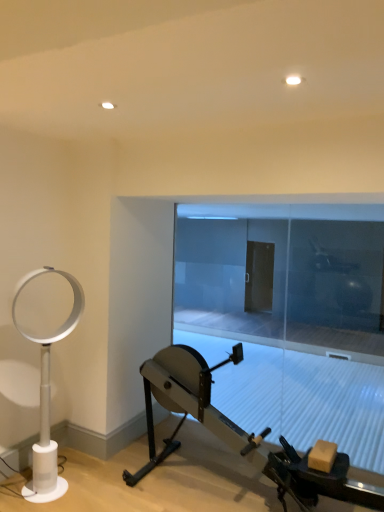
Locate an element on the screen. The width and height of the screenshot is (384, 512). metallic silver stationary bicycle at center is located at coordinates (239, 432).

What is the approximate height of white plastic fan at left?

The height of white plastic fan at left is 1.42 meters.

In order to face transparent glass door at center, should I rotate leftwards or rightwards?

Turn right approximately 10.492 degrees to face it.

This screenshot has height=512, width=384. What are the coordinates of `metallic silver stationary bicycle at center` in the screenshot? It's located at (239, 432).

Looking at the image, does metallic silver stationary bicycle at center seem bigger or smaller compared to transparent glass door at center?

metallic silver stationary bicycle at center is bigger than transparent glass door at center.

I want to click on glass door lying on the right of metallic silver stationary bicycle at center, so click(292, 325).

From the picture: Is transparent glass door at center located within metallic silver stationary bicycle at center?

No, transparent glass door at center is not inside metallic silver stationary bicycle at center.

In terms of height, does metallic silver stationary bicycle at center look taller or shorter compared to transparent glass door at center?

Considering their sizes, metallic silver stationary bicycle at center has less height than transparent glass door at center.

Based on the photo, is transparent glass door at center not close to white plastic fan at left?

That's right, there is a large distance between transparent glass door at center and white plastic fan at left.

Is transparent glass door at center facing away from white plastic fan at left?

No.

Who is shorter, transparent glass door at center or white plastic fan at left?

Standing shorter between the two is white plastic fan at left.

Can you confirm if transparent glass door at center is smaller than white plastic fan at left?

Yes, transparent glass door at center is smaller than white plastic fan at left.

Between metallic silver stationary bicycle at center and white plastic fan at left, which one has larger size?

metallic silver stationary bicycle at center.

Considering the sizes of objects metallic silver stationary bicycle at center and white plastic fan at left in the image provided, who is taller, metallic silver stationary bicycle at center or white plastic fan at left?

Standing taller between the two is white plastic fan at left.

In the scene shown: Between metallic silver stationary bicycle at center and white plastic fan at left, which one appears on the left side from the viewer's perspective?

white plastic fan at left.

How distant is metallic silver stationary bicycle at center from white plastic fan at left?

They are 3.54 feet apart.

Considering the positions of objects transparent glass door at center and metallic silver stationary bicycle at center in the image provided, who is more to the right, transparent glass door at center or metallic silver stationary bicycle at center?

From the viewer's perspective, transparent glass door at center appears more on the right side.

Does transparent glass door at center have a smaller size compared to metallic silver stationary bicycle at center?

Correct, transparent glass door at center occupies less space than metallic silver stationary bicycle at center.

From a real-world perspective, is transparent glass door at center on metallic silver stationary bicycle at center?

Yes.

Could you measure the distance between transparent glass door at center and metallic silver stationary bicycle at center?

transparent glass door at center is 3.26 meters from metallic silver stationary bicycle at center.

Would you say metallic silver stationary bicycle at center is part of white plastic fan at left's contents?

Actually, metallic silver stationary bicycle at center is outside white plastic fan at left.

From the image's perspective, which is below, white plastic fan at left or metallic silver stationary bicycle at center?

metallic silver stationary bicycle at center, from the image's perspective.

Is white plastic fan at left in front of or behind metallic silver stationary bicycle at center in the image?

white plastic fan at left is positioned farther from the viewer than metallic silver stationary bicycle at center.

From a real-world perspective, which object rests below the other?

From a 3D spatial view, metallic silver stationary bicycle at center is below.

Considering the sizes of objects white plastic fan at left and transparent glass door at center in the image provided, who is wider, white plastic fan at left or transparent glass door at center?

white plastic fan at left is wider.

Based on the photo, is white plastic fan at left smaller than transparent glass door at center?

Incorrect, white plastic fan at left is not smaller in size than transparent glass door at center.

Does point (51, 500) come farther from viewer compared to point (221, 324)?

No, (51, 500) is closer to viewer.

Which is more to the right, white plastic fan at left or transparent glass door at center?

Positioned to the right is transparent glass door at center.

I want to click on glass door above the metallic silver stationary bicycle at center (from the image's perspective), so click(x=292, y=325).

The height and width of the screenshot is (512, 384). Find the location of `table lamp on the left of transparent glass door at center`. table lamp on the left of transparent glass door at center is located at coordinates (47, 391).

From the image, which object appears to be farther from metallic silver stationary bicycle at center, transparent glass door at center or white plastic fan at left?

transparent glass door at center is further to metallic silver stationary bicycle at center.

Which object lies further to the anchor point transparent glass door at center, white plastic fan at left or metallic silver stationary bicycle at center?

Based on the image, white plastic fan at left appears to be further to transparent glass door at center.

From the image, which object appears to be nearer to transparent glass door at center, metallic silver stationary bicycle at center or white plastic fan at left?

The object closer to transparent glass door at center is metallic silver stationary bicycle at center.

Estimate the real-world distances between objects in this image. Which object is further from white plastic fan at left, transparent glass door at center or metallic silver stationary bicycle at center?

transparent glass door at center.

When comparing their distances from metallic silver stationary bicycle at center, does white plastic fan at left or transparent glass door at center seem closer?

white plastic fan at left.

Considering their positions, is metallic silver stationary bicycle at center positioned closer to white plastic fan at left than transparent glass door at center?

Among the two, metallic silver stationary bicycle at center is located nearer to white plastic fan at left.

You are a GUI agent. You are given a task and a screenshot of the screen. Output one action in this format:
    pyautogui.click(x=<x>, y=<y>)
    Task: Click on the stationary bicycle between white plastic fan at left and transparent glass door at center from left to right
    The width and height of the screenshot is (384, 512).
    Given the screenshot: What is the action you would take?
    pyautogui.click(x=239, y=432)